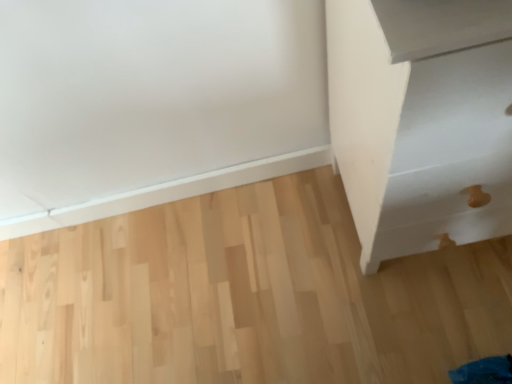
I want to click on vacant area to the left of white matte drawer at right, so click(290, 271).